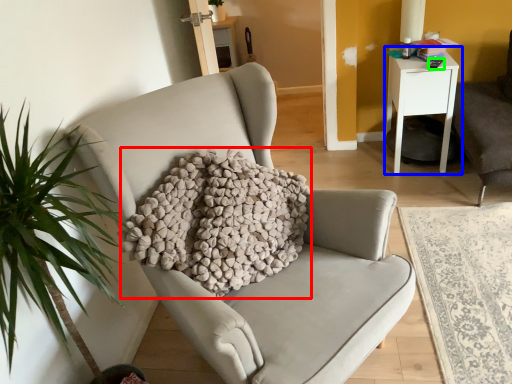
Question: Estimate the real-world distances between objects in this image. Which object is farther from pillow (highlighted by a red box), nightstand (highlighted by a blue box) or remote control (highlighted by a green box)?

Choices:
 (A) nightstand
 (B) remote control

Answer: (B)